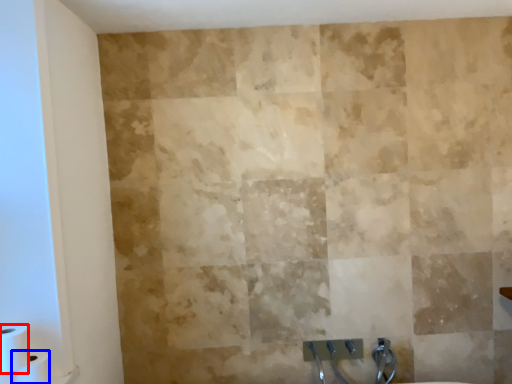
Question: Which object is closer to the camera taking this photo, toilet paper (highlighted by a red box) or toilet paper (highlighted by a blue box)?

Choices:
 (A) toilet paper
 (B) toilet paper

Answer: (A)